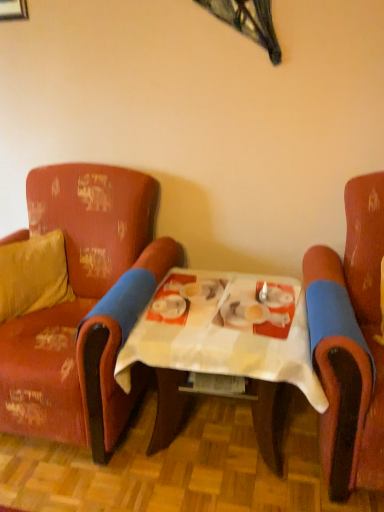
Question: Is scratched leather armchair at right, placed as the 1th chair when sorted from right to left, bigger or smaller than velvet yellow pillow at left?

Choices:
 (A) small
 (B) big

Answer: (B)

Question: Considering the positions of scratched leather armchair at right, placed as the 1th chair when sorted from right to left, and velvet yellow pillow at left in the image, is scratched leather armchair at right, placed as the 1th chair when sorted from right to left, taller or shorter than velvet yellow pillow at left?

Choices:
 (A) short
 (B) tall

Answer: (B)

Question: Which object is positioned farthest from the scratched leather armchair at right, marked as the 2th chair in a left-to-right arrangement?

Choices:
 (A) velvet yellow pillow at left
 (B) distressed red fabric armchair at left, the first chair in the left-to-right sequence
 (C) white checkered table at center

Answer: (A)

Question: Estimate the real-world distances between objects in this image. Which object is farther from the scratched leather armchair at right, marked as the 2th chair in a left-to-right arrangement?

Choices:
 (A) white checkered table at center
 (B) velvet yellow pillow at left
 (C) distressed red fabric armchair at left, the first chair in the left-to-right sequence

Answer: (B)